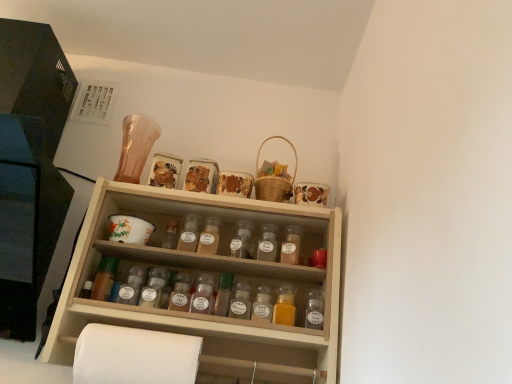
Question: Considering the relative positions of translucent glass spice jar at center, which appears as the third bottle when viewed from the left, and translucent glass spice jar at center, the third bottle in the right-to-left sequence, in the image provided, is translucent glass spice jar at center, which appears as the third bottle when viewed from the left, to the right of translucent glass spice jar at center, the third bottle in the right-to-left sequence, from the viewer's perspective?

Choices:
 (A) yes
 (B) no

Answer: (B)

Question: From the image's perspective, does translucent glass spice jar at center, positioned as the 5th bottle in right-to-left order, appear lower than translucent glass spice jar at center, the fifth bottle positioned from the left?

Choices:
 (A) yes
 (B) no

Answer: (B)

Question: Does translucent glass spice jar at center, positioned as the 5th bottle in right-to-left order, lie behind translucent glass spice jar at center, the fifth bottle positioned from the left?

Choices:
 (A) yes
 (B) no

Answer: (A)

Question: Is translucent glass spice jar at center, positioned as the 5th bottle in right-to-left order, to the left of translucent glass spice jar at center, the third bottle in the right-to-left sequence, from the viewer's perspective?

Choices:
 (A) no
 (B) yes

Answer: (B)

Question: Can you confirm if translucent glass spice jar at center, which appears as the third bottle when viewed from the left, is wider than translucent glass spice jar at center, the third bottle in the right-to-left sequence?

Choices:
 (A) yes
 (B) no

Answer: (B)

Question: Considering the relative positions of translucent glass spice jar at center, which appears as the third bottle when viewed from the left, and translucent glass spice jar at center, the fifth bottle positioned from the left, in the image provided, is translucent glass spice jar at center, which appears as the third bottle when viewed from the left, in front of translucent glass spice jar at center, the fifth bottle positioned from the left,?

Choices:
 (A) yes
 (B) no

Answer: (B)

Question: Considering the relative sizes of translucent plastic spice jar at center, which appears as the 7th bottle when viewed from the left, and translucent glass spice jar at center, the third bottle in the right-to-left sequence, in the image provided, is translucent plastic spice jar at center, which appears as the 7th bottle when viewed from the left, thinner than translucent glass spice jar at center, the third bottle in the right-to-left sequence,?

Choices:
 (A) no
 (B) yes

Answer: (A)

Question: Is translucent plastic spice jar at center, positioned as the first bottle in right-to-left order, at the right side of translucent glass spice jar at center, the fifth bottle positioned from the left?

Choices:
 (A) no
 (B) yes

Answer: (B)

Question: Would you say translucent glass spice jar at center, the fifth bottle positioned from the left, is part of translucent plastic spice jar at center, positioned as the first bottle in right-to-left order,'s contents?

Choices:
 (A) yes
 (B) no

Answer: (B)

Question: Is translucent plastic spice jar at center, positioned as the first bottle in right-to-left order, closer to camera compared to translucent glass spice jar at center, the fifth bottle positioned from the left?

Choices:
 (A) no
 (B) yes

Answer: (B)

Question: Is translucent plastic spice jar at center, positioned as the first bottle in right-to-left order, in contact with translucent glass spice jar at center, the fifth bottle positioned from the left?

Choices:
 (A) no
 (B) yes

Answer: (B)

Question: Is translucent plastic spice jar at center, positioned as the first bottle in right-to-left order, not inside translucent glass spice jar at center, the third bottle in the right-to-left sequence?

Choices:
 (A) no
 (B) yes

Answer: (B)

Question: Considering the relative sizes of translucent plastic spice jar at center, which is the 4th bottle from left to right, and translucent plastic bottle at center, acting as the 2th bottle starting from the right, in the image provided, is translucent plastic spice jar at center, which is the 4th bottle from left to right, thinner than translucent plastic bottle at center, acting as the 2th bottle starting from the right,?

Choices:
 (A) no
 (B) yes

Answer: (A)